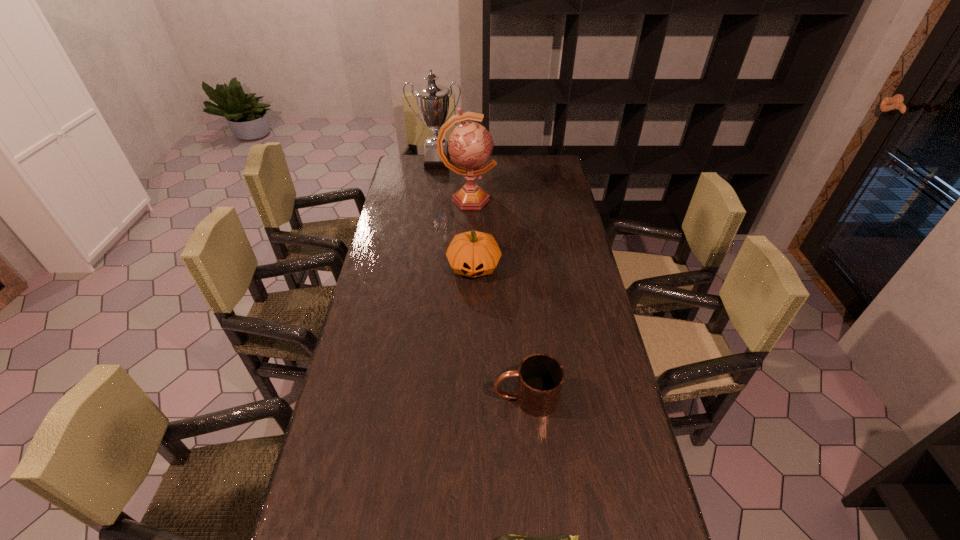
Where is `blank space located 0.370m on the side of the second nearest object with the handle`? This screenshot has height=540, width=960. blank space located 0.370m on the side of the second nearest object with the handle is located at coordinates (358, 397).

In order to click on vacant area located on the side of the second nearest object with the handle in this screenshot , I will do `click(365, 397)`.

The image size is (960, 540). Find the location of `object present at the far edge`. object present at the far edge is located at coordinates (432, 100).

What are the coordinates of `object present at the left edge` in the screenshot? It's located at (432, 100).

Where is `object located in the far left corner section of the desktop`? The image size is (960, 540). object located in the far left corner section of the desktop is located at coordinates (432, 100).

Locate an element on the screen. vacant space at the far edge is located at coordinates (446, 174).

The width and height of the screenshot is (960, 540). In the image, there is a desktop. In order to click on free space at the left edge in this screenshot , I will do `click(344, 506)`.

Identify the location of vacant space at the right edge. (574, 299).

The image size is (960, 540). Identify the location of vacant space at the far right corner of the desktop. (544, 163).

This screenshot has width=960, height=540. Find the location of `free space between the trophy cup and the fourth nearest object`. free space between the trophy cup and the fourth nearest object is located at coordinates (453, 181).